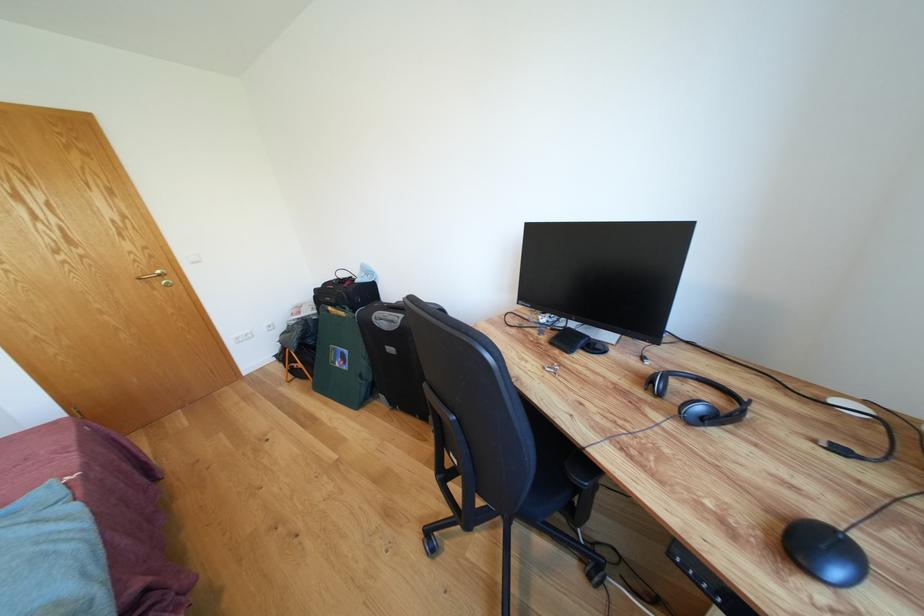
The height and width of the screenshot is (616, 924). Describe the element at coordinates (544, 472) in the screenshot. I see `the chair sitting surface` at that location.